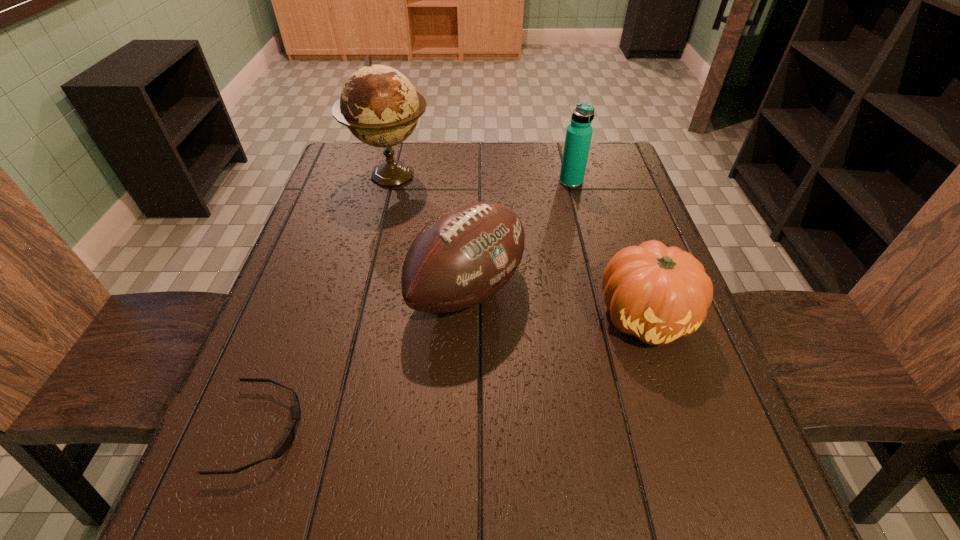
The width and height of the screenshot is (960, 540). In order to click on object positioned at the far right corner in this screenshot , I will do `click(579, 132)`.

Image resolution: width=960 pixels, height=540 pixels. Find the location of `free space at the far edge of the desktop`. free space at the far edge of the desktop is located at coordinates (447, 164).

The width and height of the screenshot is (960, 540). In the image, there is a desktop. What are the coordinates of `vacant area at the near edge` in the screenshot? It's located at (348, 480).

At what (x,y) coordinates should I click in order to perform the action: click on blank space at the left edge of the desktop. Please return your answer as a coordinate pair (x, y). Looking at the image, I should click on (343, 215).

Where is `free location at the right edge of the desktop`? free location at the right edge of the desktop is located at coordinates (611, 194).

Where is `free space between the water bottle and the tallest object`? Image resolution: width=960 pixels, height=540 pixels. free space between the water bottle and the tallest object is located at coordinates (481, 179).

Locate an element on the screen. The width and height of the screenshot is (960, 540). unoccupied position between the football (American) and the nearest object is located at coordinates (365, 360).

Where is `vacant space in between the football (American) and the nearest object`? vacant space in between the football (American) and the nearest object is located at coordinates pyautogui.click(x=365, y=360).

Identify the location of free space that is in between the football (American) and the shortest object. The height and width of the screenshot is (540, 960). (365, 360).

Where is `vacant point located between the water bottle and the pumpkin`? This screenshot has height=540, width=960. vacant point located between the water bottle and the pumpkin is located at coordinates (608, 249).